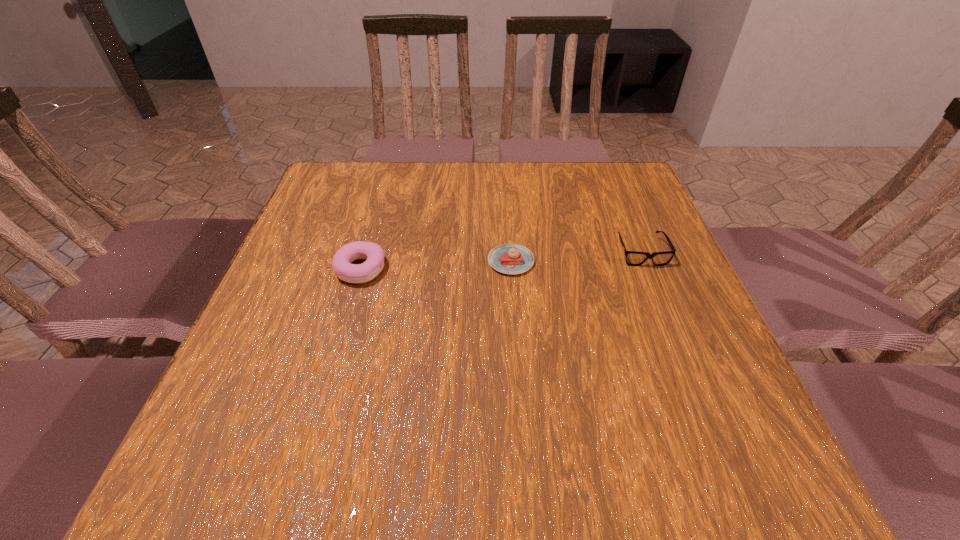
The width and height of the screenshot is (960, 540). What are the coordinates of `object that stands as the second closest to the shortest object` in the screenshot? It's located at (373, 253).

Identify which object is the closest to the left pastry. Please provide its 2D coordinates. Your answer should be formatted as a tuple, i.e. [(x, y)], where the tuple contains the x and y coordinates of a point satisfying the conditions above.

[(509, 258)]